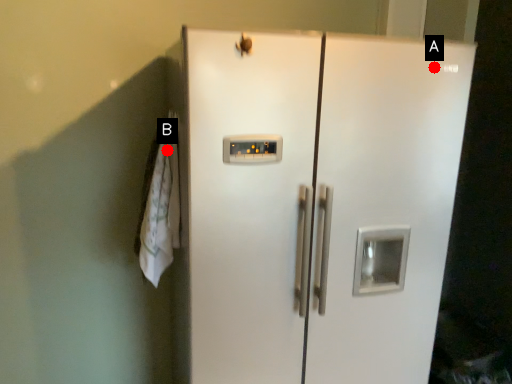
Question: Two points are circled on the image, labeled by A and B beside each circle. Which of the following is the farthest from the observer?

Choices:
 (A) A is further
 (B) B is further

Answer: (B)